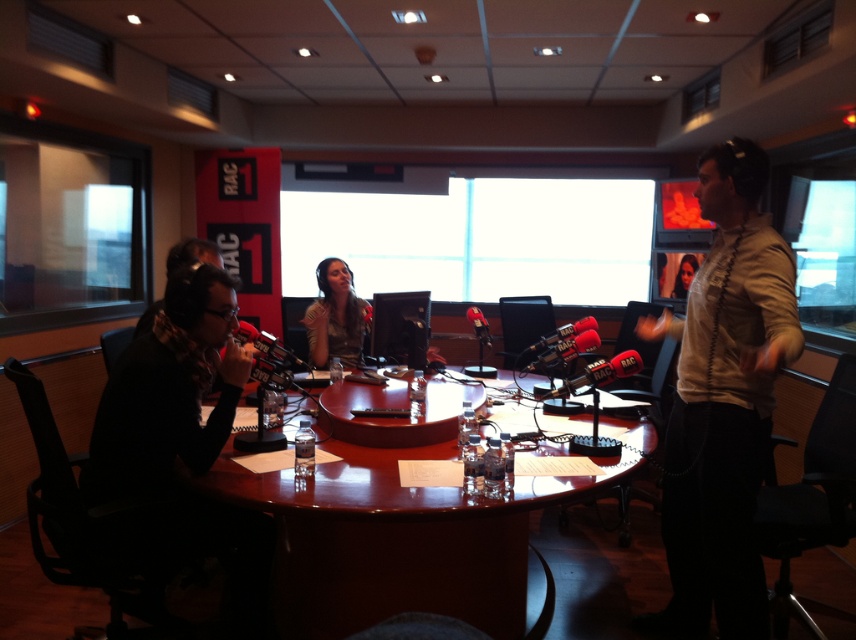
Question: Which object appears closest to the camera in this image?

Choices:
 (A) matte black hair at center
 (B) brown wooden table at center
 (C) striped fabric shirt at center
 (D) light beige shirt at right

Answer: (D)

Question: Does light beige shirt at right lie behind striped fabric shirt at center?

Choices:
 (A) no
 (B) yes

Answer: (A)

Question: Does brown wooden table at center lie behind matte black hair at center?

Choices:
 (A) no
 (B) yes

Answer: (A)

Question: Can you confirm if brown wooden table at center is positioned above striped fabric shirt at center?

Choices:
 (A) no
 (B) yes

Answer: (A)

Question: Based on their relative distances, which object is nearer to the brown wooden table at center?

Choices:
 (A) matte black hair at center
 (B) striped fabric shirt at center
 (C) light beige shirt at right

Answer: (C)

Question: Among these points, which one is nearest to the camera?

Choices:
 (A) tap(342, 317)
 (B) tap(672, 294)

Answer: (A)